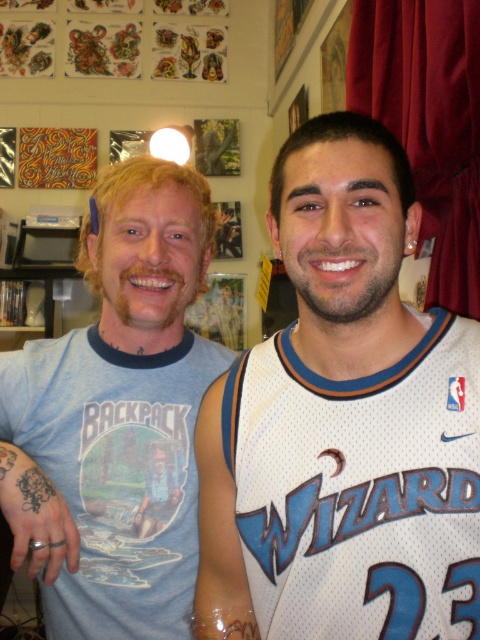
Is point (197, 576) more distant than point (3, 461)?

No.

Which is in front, point (205, 493) or point (48, 568)?

Point (48, 568)

Is point (242, 368) farther from camera compared to point (7, 416)?

No, (242, 368) is in front of (7, 416).

Find the location of a particular element. clear plastic bandage at upper right is located at coordinates (219, 518).

Can you confirm if blue t-shirt at left is positioned to the right of clear plastic bandage at upper right?

In fact, blue t-shirt at left is to the left of clear plastic bandage at upper right.

Can you confirm if blue t-shirt at left is shorter than clear plastic bandage at upper right?

In fact, blue t-shirt at left may be taller than clear plastic bandage at upper right.

Does point (47, 557) come behind point (204, 628)?

Yes.

Find the location of `blue t-shirt at left`. blue t-shirt at left is located at coordinates (118, 417).

Between point (334, 186) and point (181, 330), which one is positioned behind?

Point (181, 330)

Is white jersey at center smaller than blue t-shirt at left?

Yes, white jersey at center is smaller than blue t-shirt at left.

Who is more distant from viewer, (307, 131) or (171, 481)?

Positioned behind is point (171, 481).

Locate an element on the screen. The height and width of the screenshot is (640, 480). white jersey at center is located at coordinates (343, 422).